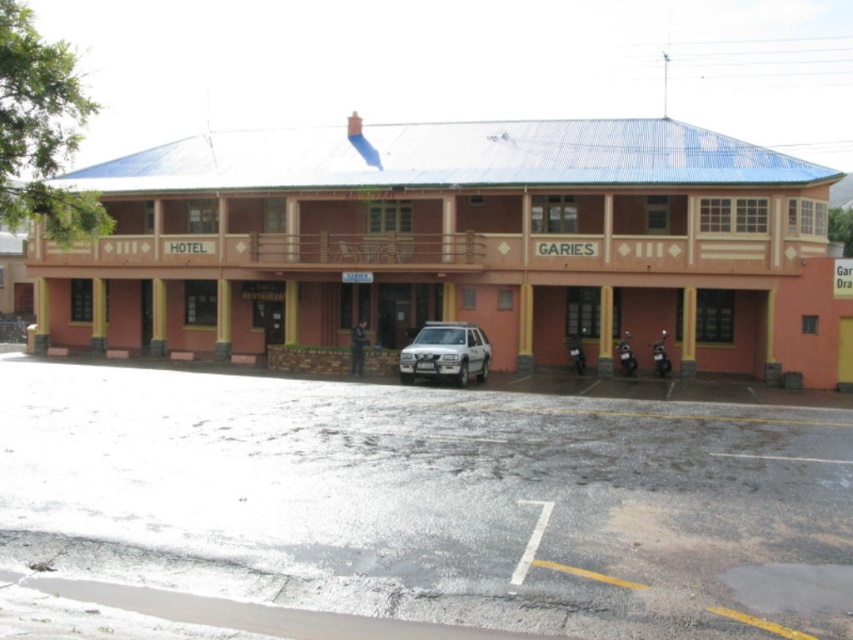
Does gray asphalt parking lot at center have a greater width compared to white matte suv at center?

Correct, the width of gray asphalt parking lot at center exceeds that of white matte suv at center.

Which of these two, gray asphalt parking lot at center or white matte suv at center, stands shorter?

With less height is gray asphalt parking lot at center.

Is point (590, 472) in front of point (463, 337)?

Yes, it is.

Where is `gray asphalt parking lot at center`? The image size is (853, 640). gray asphalt parking lot at center is located at coordinates (434, 500).

Who is more forward, (450, 330) or (567, 352)?

Point (450, 330) is more forward.

This screenshot has height=640, width=853. What do you see at coordinates (445, 353) in the screenshot? I see `white matte suv at center` at bounding box center [445, 353].

Who is more distant from viewer, (434, 339) or (573, 356)?

The point (573, 356) is behind.

Locate an element on the screen. The height and width of the screenshot is (640, 853). white matte suv at center is located at coordinates (445, 353).

Who is lower down, gray asphalt parking lot at center or metallic silver motorcycle at center?

Positioned lower is gray asphalt parking lot at center.

Identify the location of gray asphalt parking lot at center. This screenshot has width=853, height=640. (434, 500).

Is point (202, 538) closer to camera compared to point (573, 364)?

Yes, it is.

I want to click on gray asphalt parking lot at center, so click(434, 500).